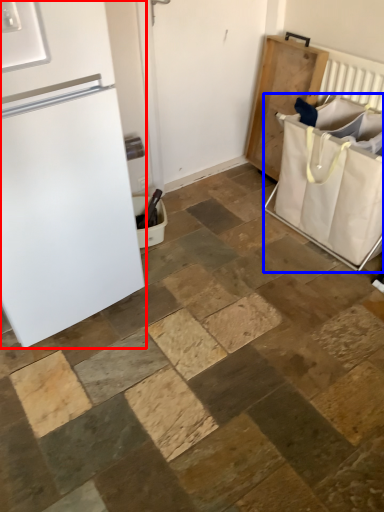
Question: Which object appears closest to the camera in this image, refrigerator (highlighted by a red box) or laundry basket (highlighted by a blue box)?

Choices:
 (A) refrigerator
 (B) laundry basket

Answer: (A)